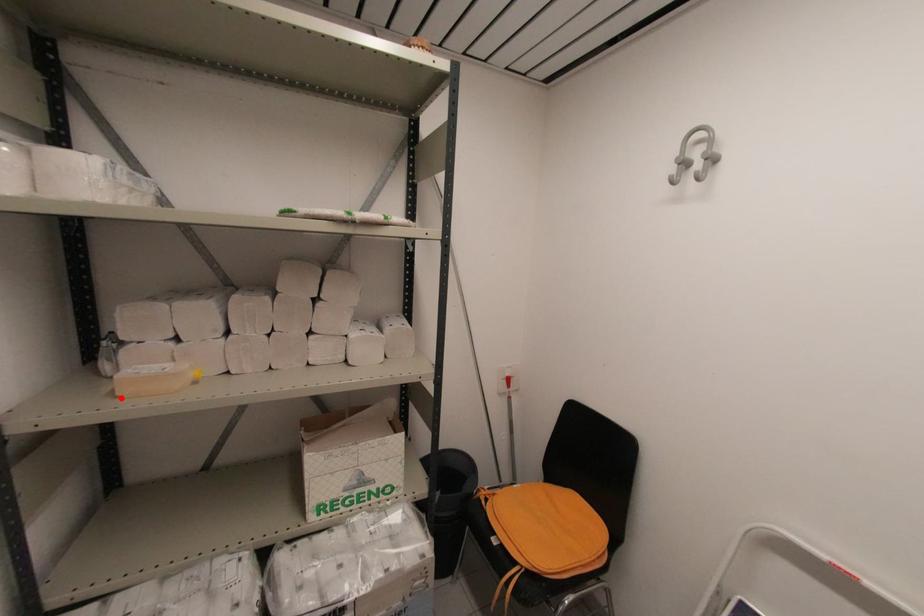
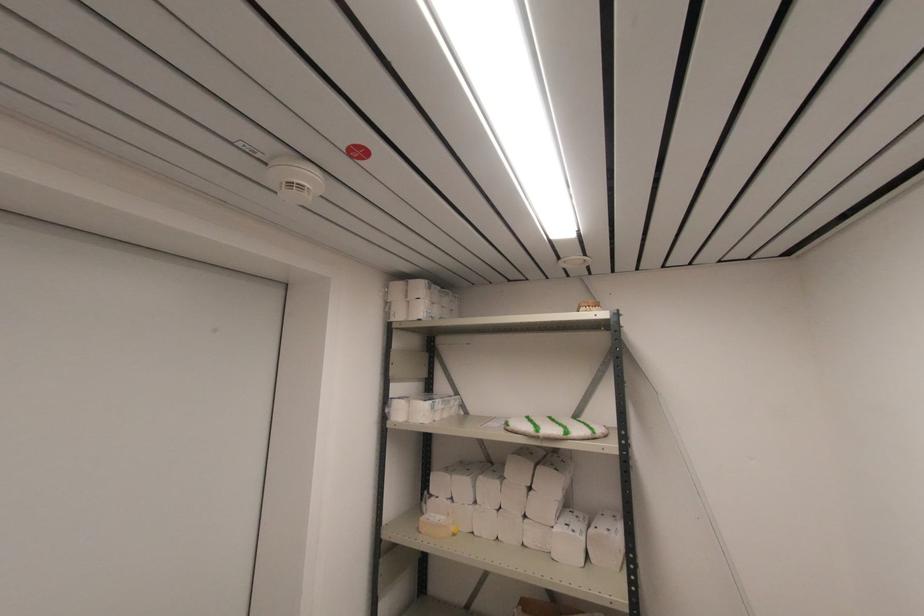
The point at the highlighted location is marked in the first image. Where is the corresponding point in the second image?

(420, 533)